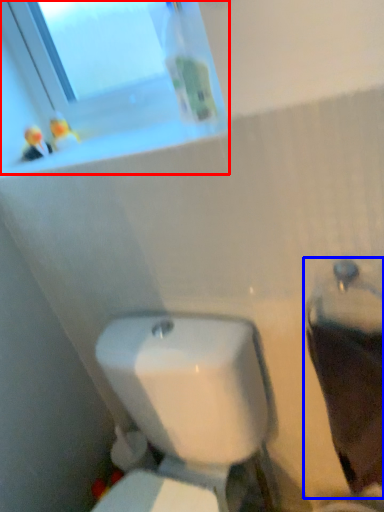
Question: Which object is further to the camera taking this photo, window (highlighted by a red box) or porcelain (highlighted by a blue box)?

Choices:
 (A) window
 (B) porcelain

Answer: (A)